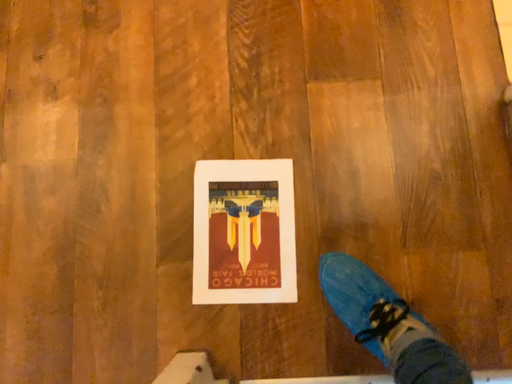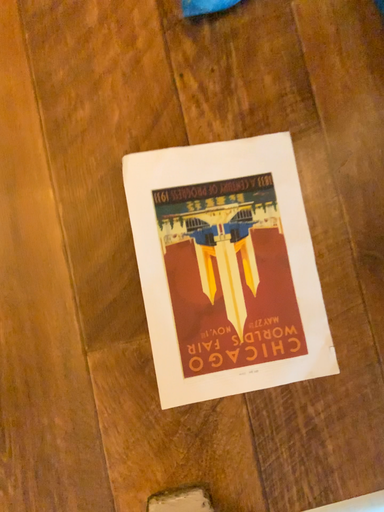
Question: How did the camera likely rotate when shooting the video?

Choices:
 (A) rotated left
 (B) rotated right

Answer: (B)